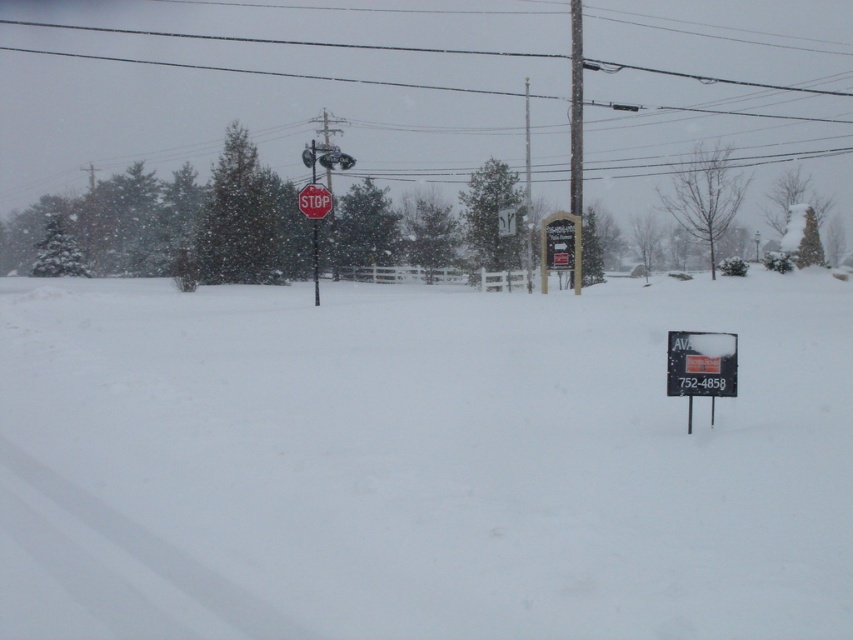
Question: Among these objects, which one is farthest from the camera?

Choices:
 (A) red plastic stop sign at center
 (B) white powdery snow at center
 (C) metallic gray pole at center

Answer: (C)

Question: Which of the following is the closest to the observer?

Choices:
 (A) black plastic sign at center
 (B) metallic wire at upper center

Answer: (A)

Question: Where is white powdery snow at center located in relation to metallic gray pole at center in the image?

Choices:
 (A) left
 (B) right

Answer: (A)

Question: Is metallic wire at upper center positioned behind red plastic stop sign at center?

Choices:
 (A) yes
 (B) no

Answer: (A)

Question: Is white powdery snow at center smaller than black plastic sign at lower right?

Choices:
 (A) no
 (B) yes

Answer: (A)

Question: Which object is positioned closest to the black plastic sign at lower right?

Choices:
 (A) metallic gray pole at center
 (B) red plastic stop sign at center
 (C) black plastic sign at center
 (D) metallic wire at upper center

Answer: (B)